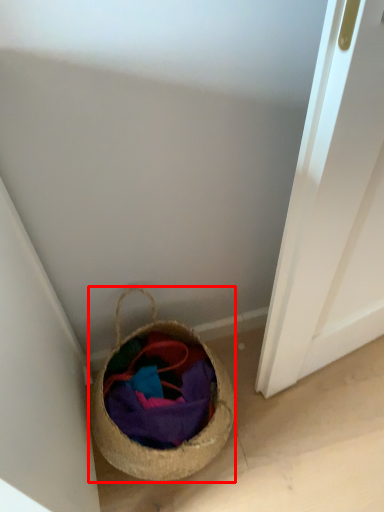
Question: From the image, what is the correct spatial relationship of basket (annotated by the red box) in relation to fabric?

Choices:
 (A) left
 (B) right

Answer: (A)